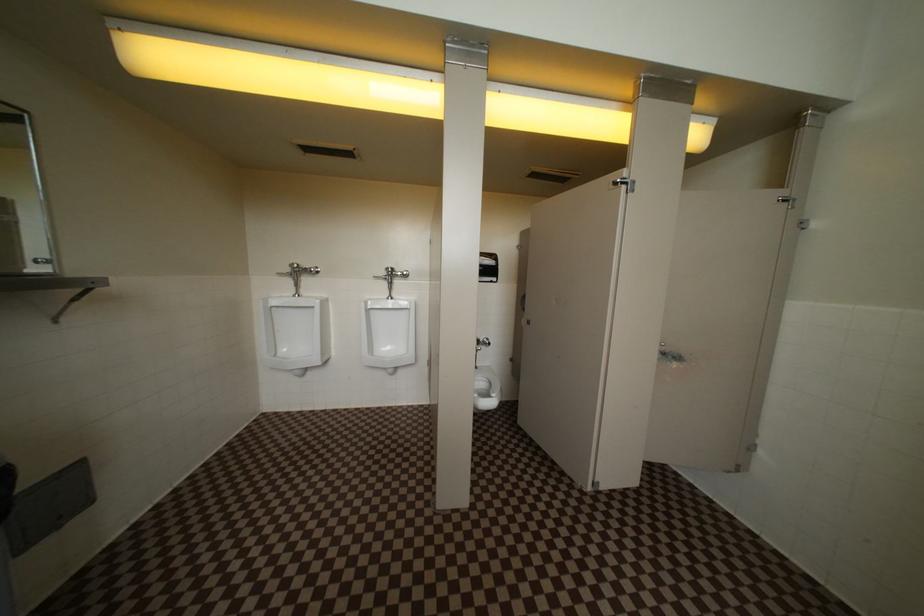
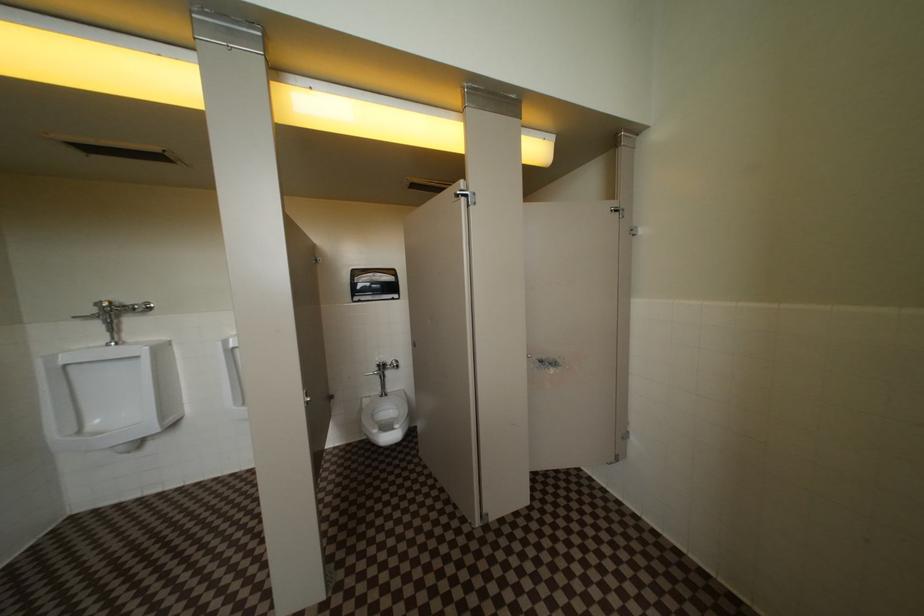
Question: The first image is from the beginning of the video and the second image is from the end. How did the camera likely rotate when shooting the video?

Choices:
 (A) Left
 (B) Right
 (C) Up
 (D) Down

Answer: (B)